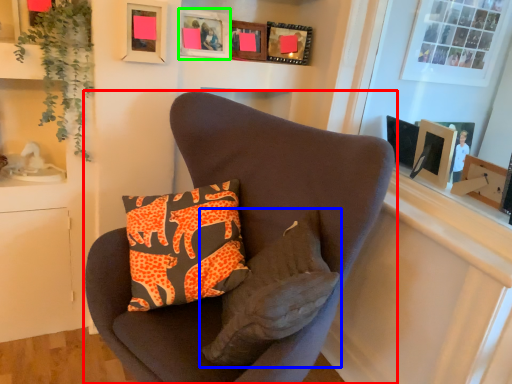
Question: Which object is positioned closest to chair (highlighted by a red box)? Select from pillow (highlighted by a blue box) and picture frame (highlighted by a green box).

Choices:
 (A) pillow
 (B) picture frame

Answer: (A)